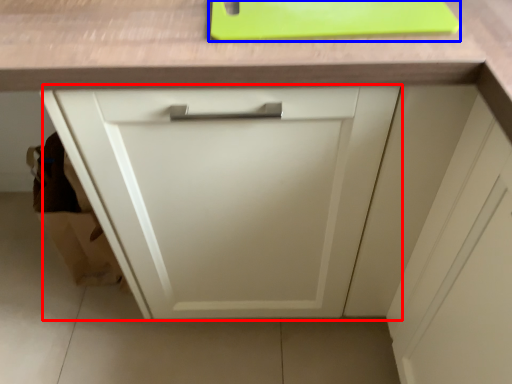
Question: Which point is closer to the camera, cabinetry (highlighted by a red box) or cutting board (highlighted by a blue box)?

Choices:
 (A) cabinetry
 (B) cutting board

Answer: (A)